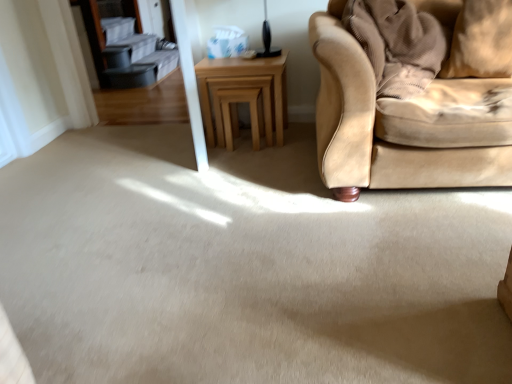
Question: Is beige fabric pillow at upper right thinner than light brown wooden stool at center?

Choices:
 (A) no
 (B) yes

Answer: (B)

Question: Does beige fabric pillow at upper right have a greater height compared to light brown wooden stool at center?

Choices:
 (A) yes
 (B) no

Answer: (B)

Question: Is the surface of beige fabric pillow at upper right in direct contact with light brown wooden stool at center?

Choices:
 (A) no
 (B) yes

Answer: (A)

Question: Does beige fabric pillow at upper right appear on the right side of light brown wooden stool at center?

Choices:
 (A) no
 (B) yes

Answer: (B)

Question: Is beige fabric pillow at upper right smaller than light brown wooden stool at center?

Choices:
 (A) no
 (B) yes

Answer: (B)

Question: From a real-world perspective, is beige fabric pillow at upper right above or below light brown wooden stool at center?

Choices:
 (A) above
 (B) below

Answer: (A)

Question: Would you say beige fabric pillow at upper right is inside or outside light brown wooden stool at center?

Choices:
 (A) outside
 (B) inside

Answer: (A)

Question: In terms of size, does beige fabric pillow at upper right appear bigger or smaller than light brown wooden stool at center?

Choices:
 (A) big
 (B) small

Answer: (B)

Question: Looking at their shapes, would you say beige fabric pillow at upper right is wider or thinner than light brown wooden stool at center?

Choices:
 (A) wide
 (B) thin

Answer: (B)

Question: Based on their positions, is light brown wooden table at center located to the left or right of beige fabric pillow at upper right?

Choices:
 (A) left
 (B) right

Answer: (A)

Question: From the image's perspective, is light brown wooden table at center located above or below beige fabric pillow at upper right?

Choices:
 (A) above
 (B) below

Answer: (B)

Question: Is light brown wooden table at center in front of or behind beige fabric pillow at upper right in the image?

Choices:
 (A) behind
 (B) front

Answer: (A)

Question: Considering the positions of light brown wooden table at center and beige fabric pillow at upper right in the image, is light brown wooden table at center bigger or smaller than beige fabric pillow at upper right?

Choices:
 (A) small
 (B) big

Answer: (B)

Question: Looking at their shapes, would you say light brown wooden stool at center is wider or thinner than light brown wooden table at center?

Choices:
 (A) thin
 (B) wide

Answer: (A)

Question: From a real-world perspective, is light brown wooden stool at center positioned above or below light brown wooden table at center?

Choices:
 (A) above
 (B) below

Answer: (B)